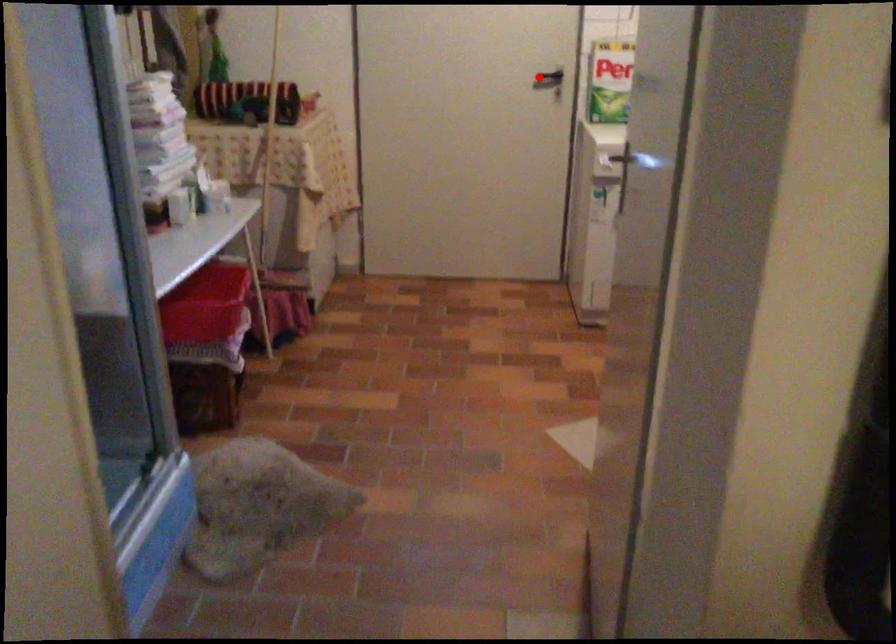
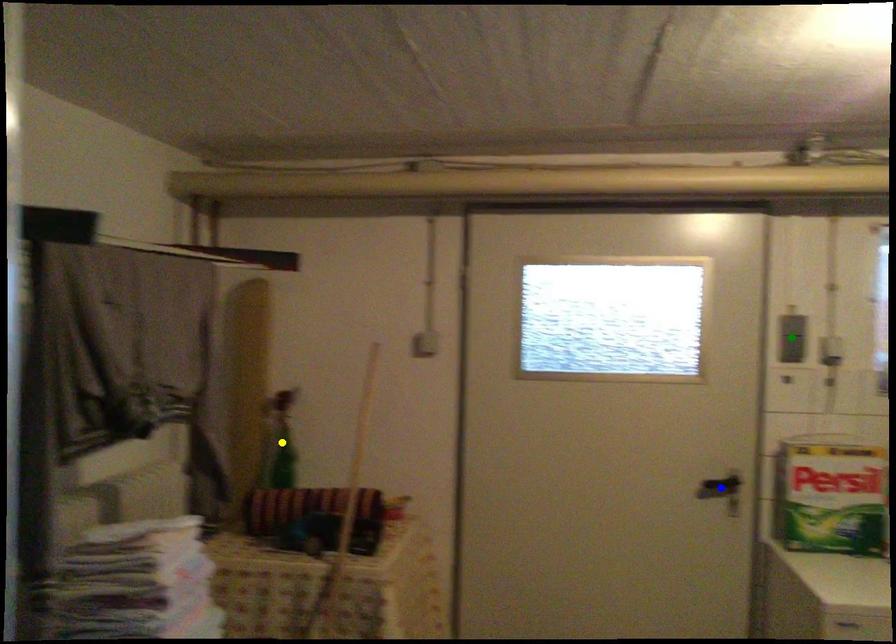
Question: I am providing you with two images of the same scene from different viewpoints. A red point is marked on the first image. You are given multiple points on the second image. Which spot in image 2 lines up with the point in image 1?

Choices:
 (A) yellow point
 (B) green point
 (C) blue point

Answer: (C)